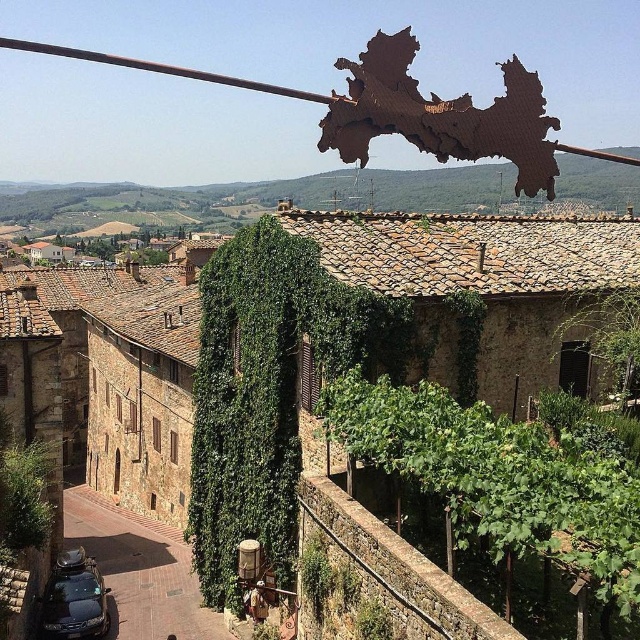
You are standing at the entrance of the village and want to take a photo of the brown stone town at center. Based on its position, where should you aim your camera to capture it properly?

The brown stone town at center is located at point (106,376), so you should aim your camera towards the coordinates (106,376) to capture it properly.

You are a tour guide leading a group of tourists in the historic European village. You want to take a photo that captures both the brown stone town at center and the shiny black car at lower left. Can you position yourself so that both are fully visible in the frame without any part being cut off?

The brown stone town at center might be wider than the shiny black car at lower left, so you should position yourself to ensure both are fully visible in the frame. However, since the width relationship isn not certain, you may need to adjust your angle or zoom to accommodate both.